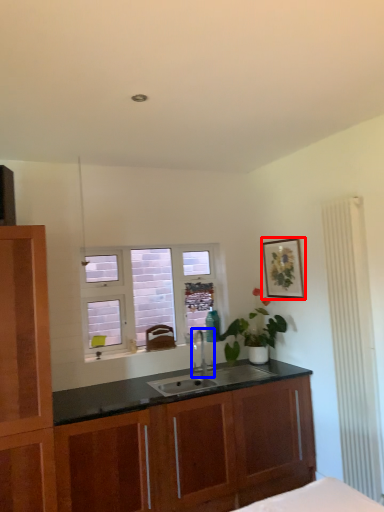
Question: Which point is further to the camera, picture frame (highlighted by a red box) or tap (highlighted by a blue box)?

Choices:
 (A) picture frame
 (B) tap

Answer: (A)